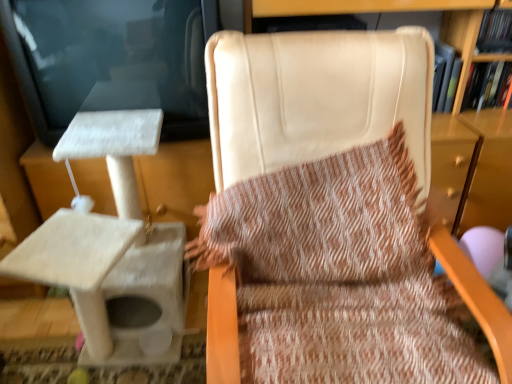
Question: Could you tell me if white textured cat tree at left is facing beige leather chair at center?

Choices:
 (A) yes
 (B) no

Answer: (B)

Question: Is white textured cat tree at left facing away from beige leather chair at center?

Choices:
 (A) yes
 (B) no

Answer: (B)

Question: Can you confirm if white textured cat tree at left is positioned to the left of beige leather chair at center?

Choices:
 (A) yes
 (B) no

Answer: (A)

Question: Is white textured cat tree at left not near beige leather chair at center?

Choices:
 (A) yes
 (B) no

Answer: (B)

Question: Can you confirm if white textured cat tree at left is bigger than beige leather chair at center?

Choices:
 (A) no
 (B) yes

Answer: (A)

Question: From the image's perspective, is white textured cat tree at left on beige leather chair at center?

Choices:
 (A) no
 (B) yes

Answer: (B)

Question: From a real-world perspective, is beige leather chair at center under white textured cat tree at left?

Choices:
 (A) no
 (B) yes

Answer: (A)

Question: Is beige leather chair at center far away from white textured cat tree at left?

Choices:
 (A) no
 (B) yes

Answer: (A)

Question: Is beige leather chair at center wider than white textured cat tree at left?

Choices:
 (A) yes
 (B) no

Answer: (A)

Question: From the image's perspective, is beige leather chair at center below white textured cat tree at left?

Choices:
 (A) yes
 (B) no

Answer: (A)

Question: Considering the relative sizes of beige leather chair at center and white textured cat tree at left in the image provided, is beige leather chair at center taller than white textured cat tree at left?

Choices:
 (A) yes
 (B) no

Answer: (A)

Question: Is beige leather chair at center positioned behind white textured cat tree at left?

Choices:
 (A) yes
 (B) no

Answer: (B)

Question: Considering the relative positions of beige leather chair at center and hardcover book at upper right in the image provided, is beige leather chair at center behind hardcover book at upper right?

Choices:
 (A) yes
 (B) no

Answer: (B)